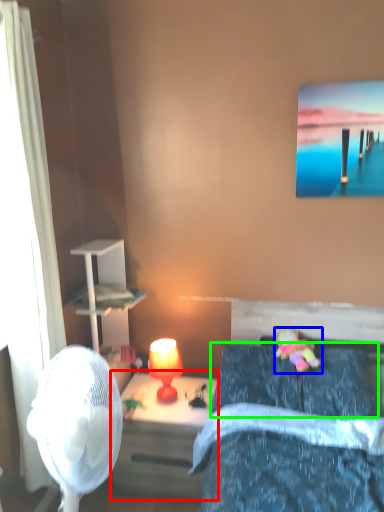
Question: Estimate the real-world distances between objects in this image. Which object is farther from nightstand (highlighted by a red box), toy (highlighted by a blue box) or pillow (highlighted by a green box)?

Choices:
 (A) toy
 (B) pillow

Answer: (A)